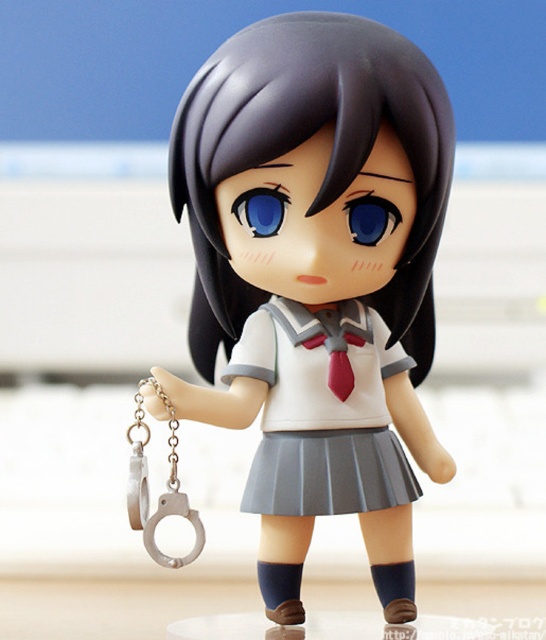
Who is more distant from viewer, (393, 340) or (408, 488)?

The point (393, 340) is more distant.

Does matte plastic figure at center appear on the right side of white matte uniform skirt at center?

In fact, matte plastic figure at center is to the left of white matte uniform skirt at center.

The image size is (546, 640). I want to click on matte plastic figure at center, so click(x=317, y=280).